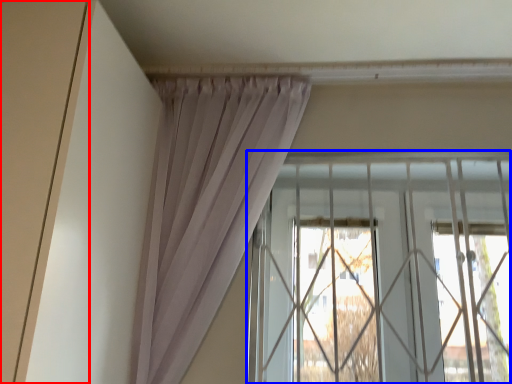
Question: Which object is closer to the camera taking this photo, door (highlighted by a red box) or window (highlighted by a blue box)?

Choices:
 (A) door
 (B) window

Answer: (A)